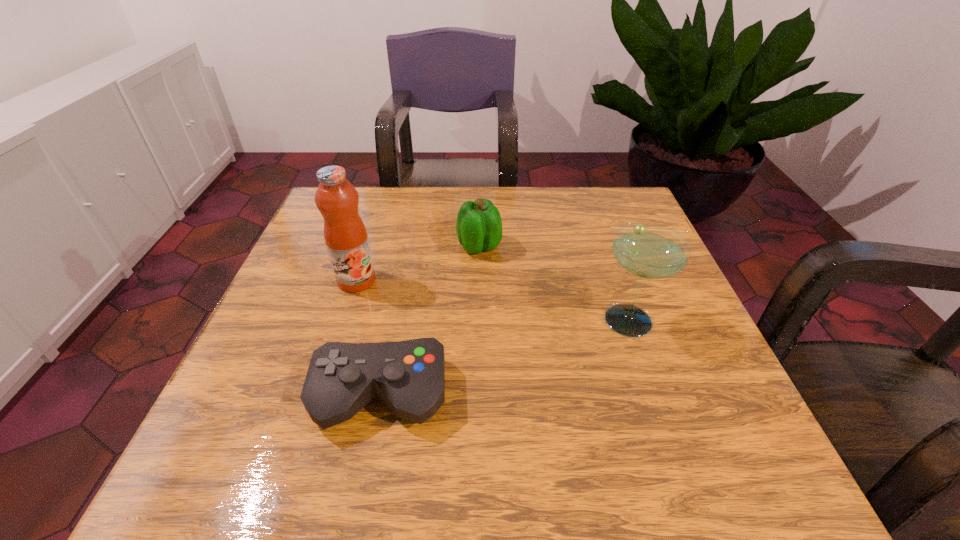
Image resolution: width=960 pixels, height=540 pixels. I want to click on vacant area located 0.110m on the front of the bell pepper, so point(479,293).

You are a GUI agent. You are given a task and a screenshot of the screen. Output one action in this format:
    pyautogui.click(x=<x>, y=<y>)
    Task: Click on the vacant position located 0.250m on the right of the control
    
    Given the screenshot: What is the action you would take?
    pyautogui.click(x=598, y=395)

Identify the location of object situated at the far edge. Image resolution: width=960 pixels, height=540 pixels. (479, 226).

At what (x,y) coordinates should I click in order to perform the action: click on object present at the near edge. Please return your answer as a coordinate pair (x, y). This screenshot has width=960, height=540. Looking at the image, I should click on (408, 376).

Image resolution: width=960 pixels, height=540 pixels. I want to click on fruit juice at the left edge, so click(x=345, y=234).

Identify the location of control positioned at the left edge. The image size is (960, 540). (408, 376).

Locate an element on the screen. Image resolution: width=960 pixels, height=540 pixels. object that is positioned at the right edge is located at coordinates (648, 250).

This screenshot has height=540, width=960. What are the coordinates of `object at the near left corner` in the screenshot? It's located at (408, 376).

The width and height of the screenshot is (960, 540). I want to click on vacant space at the far edge of the desktop, so pos(510,216).

Identify the location of vacant space at the near edge of the desktop. (402, 482).